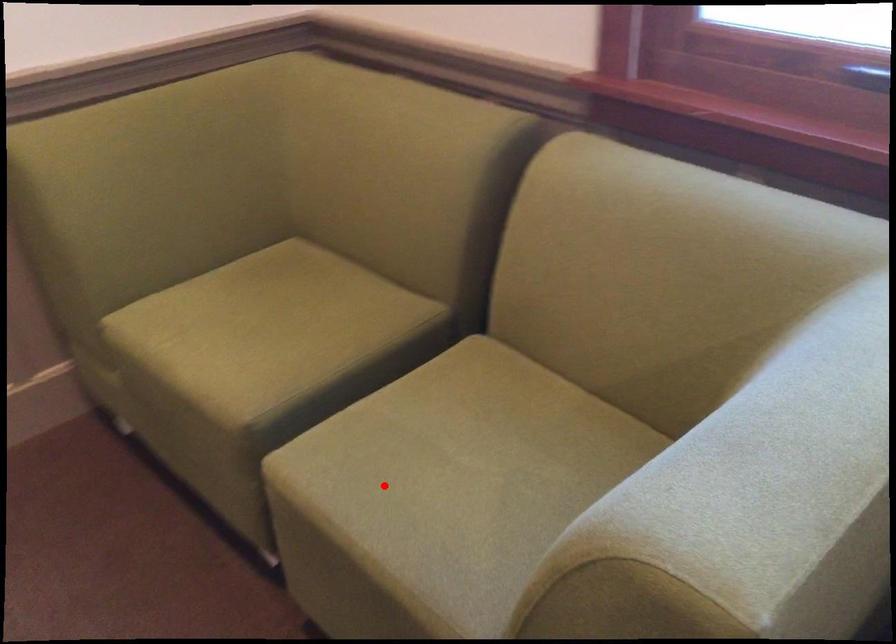
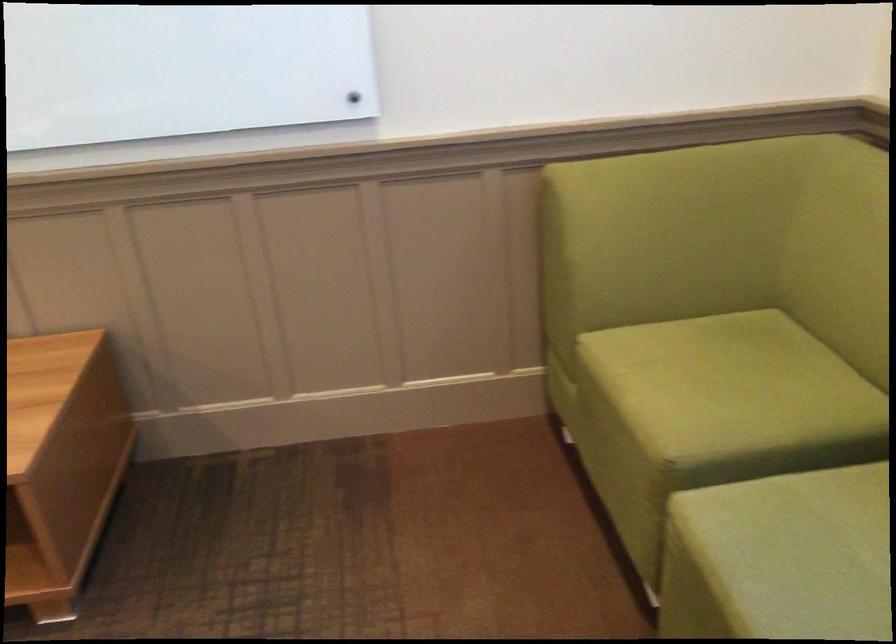
The point at the highlighted location is marked in the first image. Where is the corresponding point in the second image?

(780, 558)